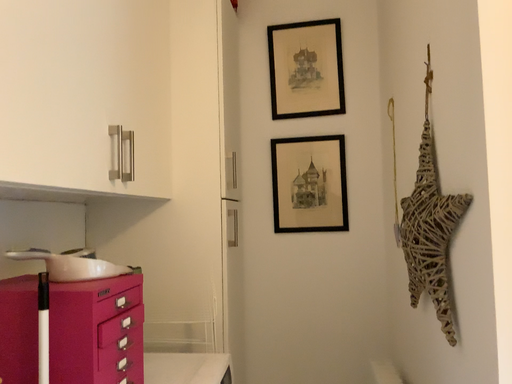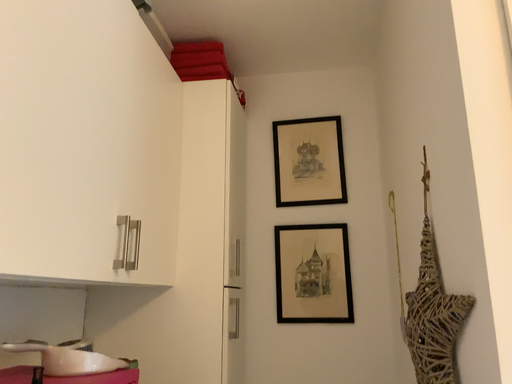
Question: How did the camera likely rotate when shooting the video?

Choices:
 (A) rotated downward
 (B) rotated upward

Answer: (B)